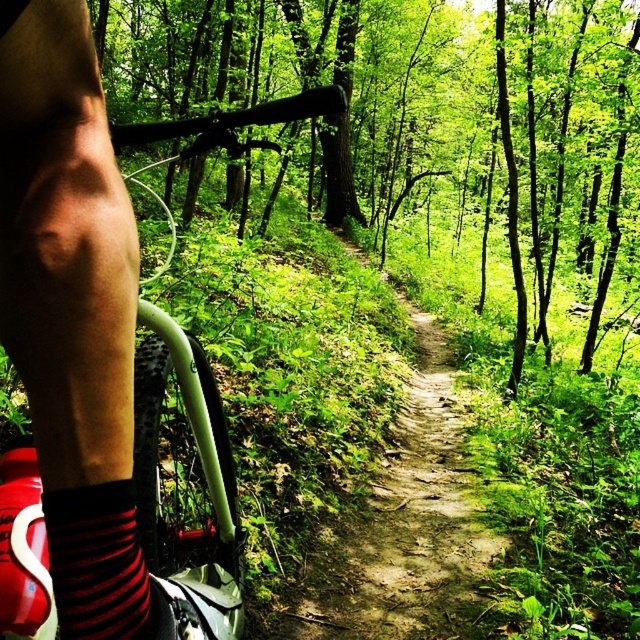
Does green matte mountain bike at left have a greater width compared to red striped sock at lower left?

Indeed, green matte mountain bike at left has a greater width compared to red striped sock at lower left.

Between point (214, 529) and point (132, 492), which one is positioned in front?

Positioned in front is point (132, 492).

Is point (212, 609) behind point (128, 616)?

Yes.

Locate an element on the screen. The height and width of the screenshot is (640, 640). green matte mountain bike at left is located at coordinates (202, 474).

Does black sock at left have a larger size compared to green matte mountain bike at left?

Incorrect, black sock at left is not larger than green matte mountain bike at left.

Can you confirm if black sock at left is shorter than green matte mountain bike at left?

Correct, black sock at left is not as tall as green matte mountain bike at left.

Between point (33, 273) and point (1, 547), which one is positioned behind?

Positioned behind is point (1, 547).

Identify the location of black sock at left. (72, 316).

In the scene shown: Who is taller, black sock at left or dirt path at center?

Standing taller between the two is black sock at left.

Does black sock at left appear on the right side of dirt path at center?

No, black sock at left is not to the right of dirt path at center.

Is point (97, 282) farther from camera compared to point (392, 602)?

No, it is in front of (392, 602).

Where is `black sock at left`? black sock at left is located at coordinates (72, 316).